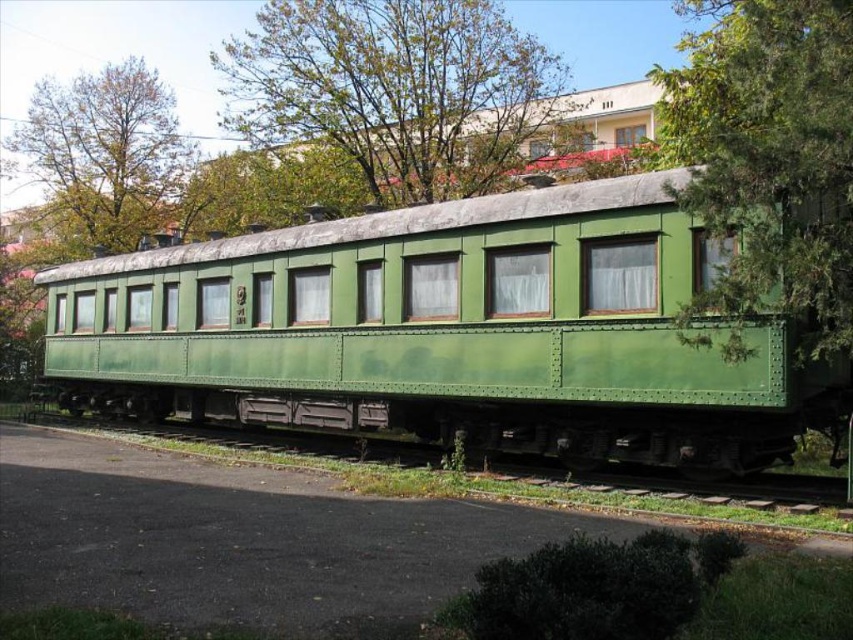
You are standing in front of the vintage green train carriage and notice two green leafy trees in the background. Which tree, the green leafy tree at upper center or the green leafy tree at upper left, is taller?

The green leafy tree at upper center is taller than the green leafy tree at upper left.

You are standing in front of the vintage green train carriage. There is a point marked at coordinates (770, 157). Based on the scene description, can you determine what object this point is located on?

The point at coordinates (770, 157) is located on the green textured tree at upper right.